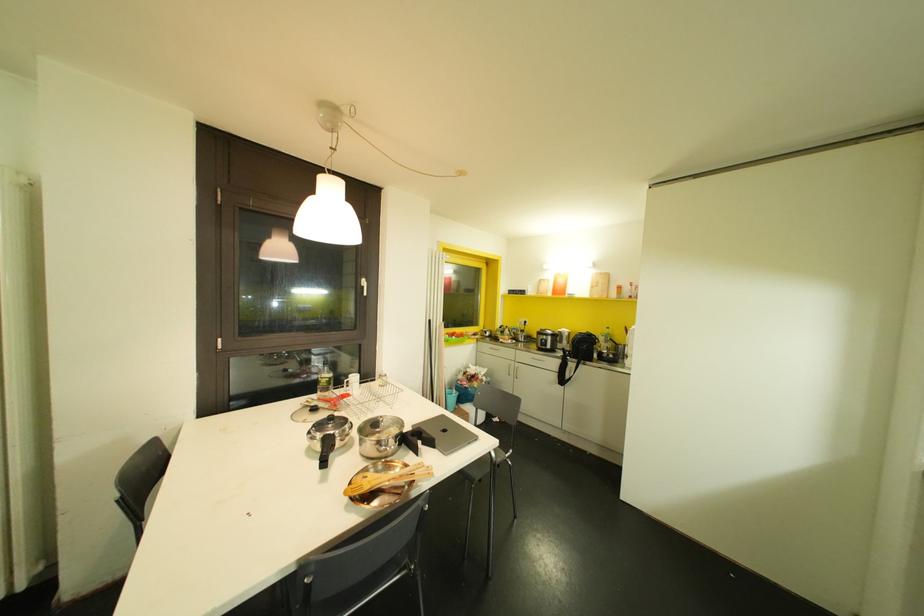
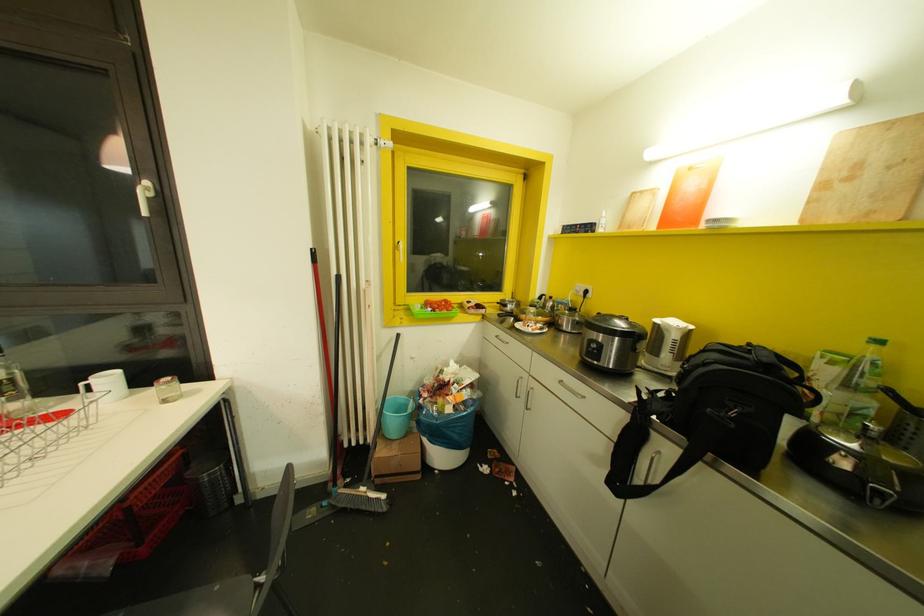
Which direction would the cameraman need to move to produce the second image?

The cameraman walked toward right, forward.